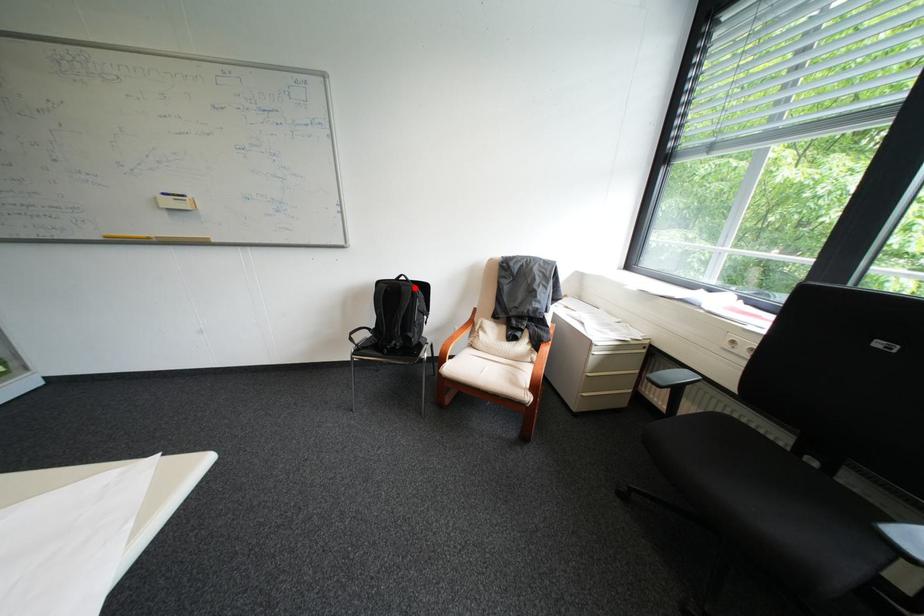
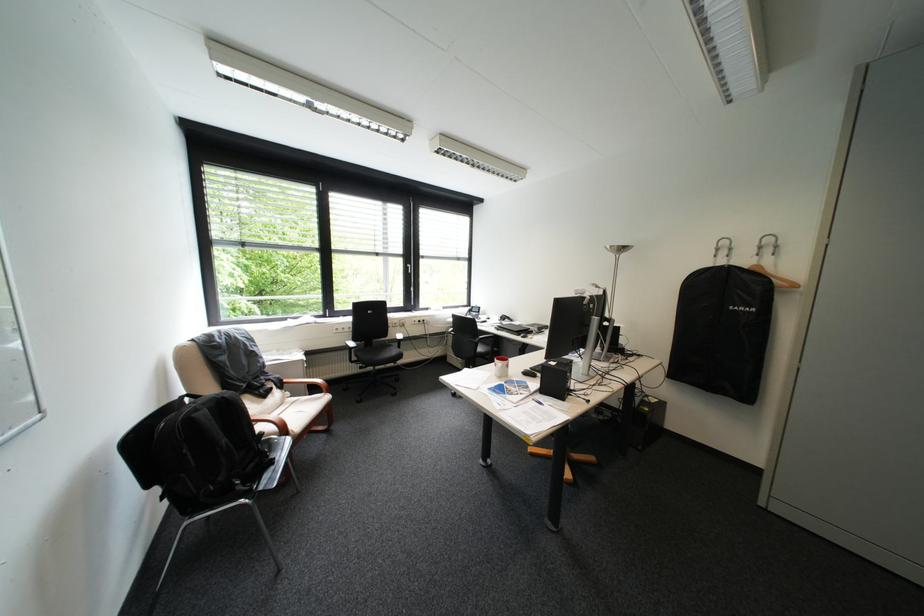
Question: A red point is marked in image1. In image2, is the corresponding 3D point closer to the camera or farther? Reply with the corresponding letter.

Choices:
 (A) The corresponding 3D point is closer.
 (B) The corresponding 3D point is farther.

Answer: (A)